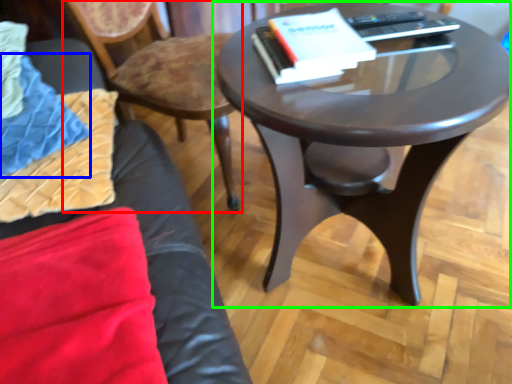
Question: Which object is the closest to the chair (highlighted by a red box)? Choose among these: blanket (highlighted by a blue box) or coffee table (highlighted by a green box).

Choices:
 (A) blanket
 (B) coffee table

Answer: (A)